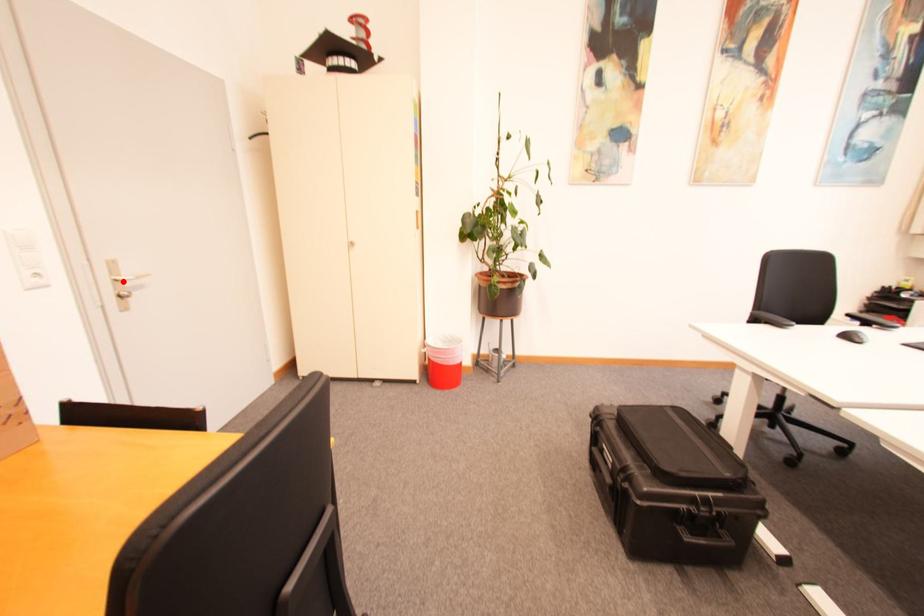
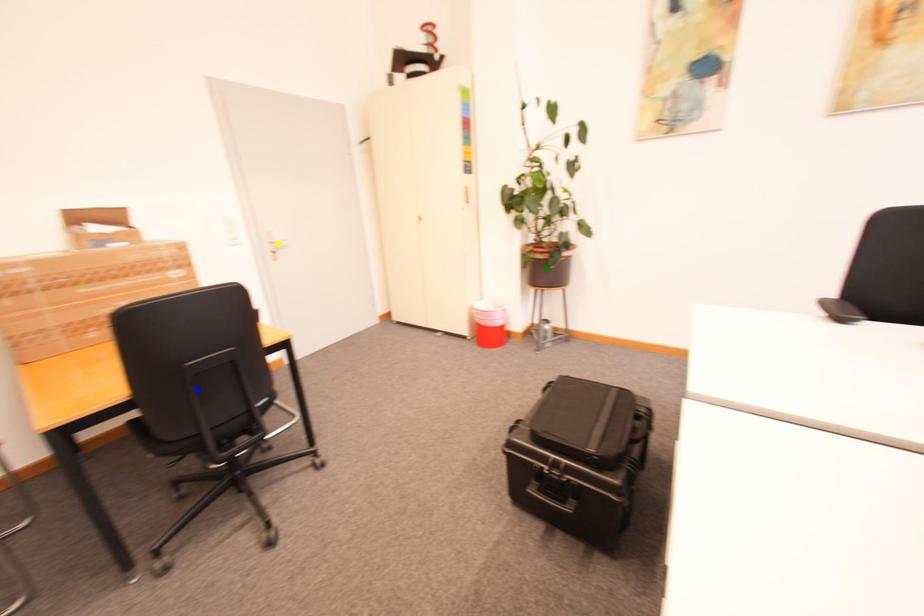
Question: I am providing you with two images of the same scene from different viewpoints. A red point is marked on the first image. You are given multiple points on the second image. Can you choose the point in image 2 that corresponds to the point in image 1?

Choices:
 (A) green point
 (B) yellow point
 (C) blue point

Answer: (B)